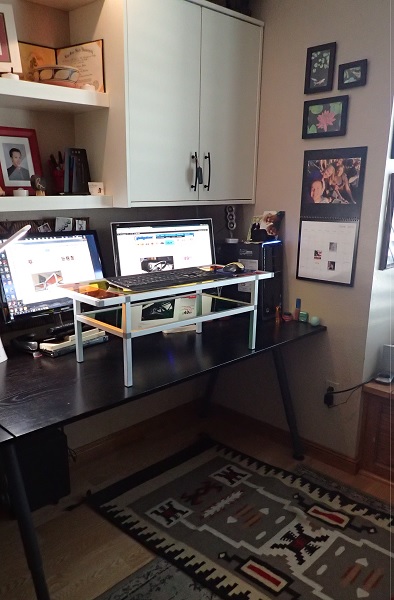
Where is `table legs`? table legs is located at coordinates [x=25, y=506].